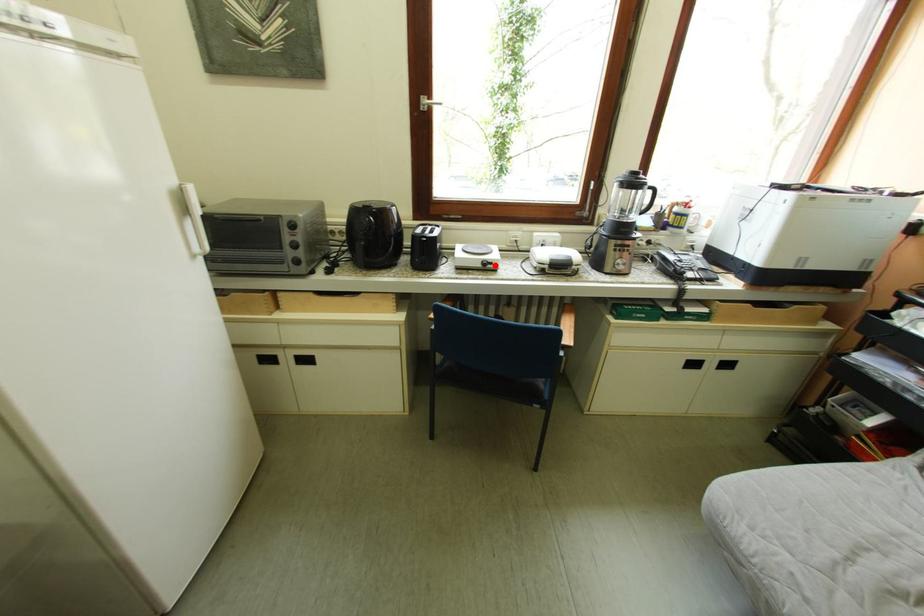
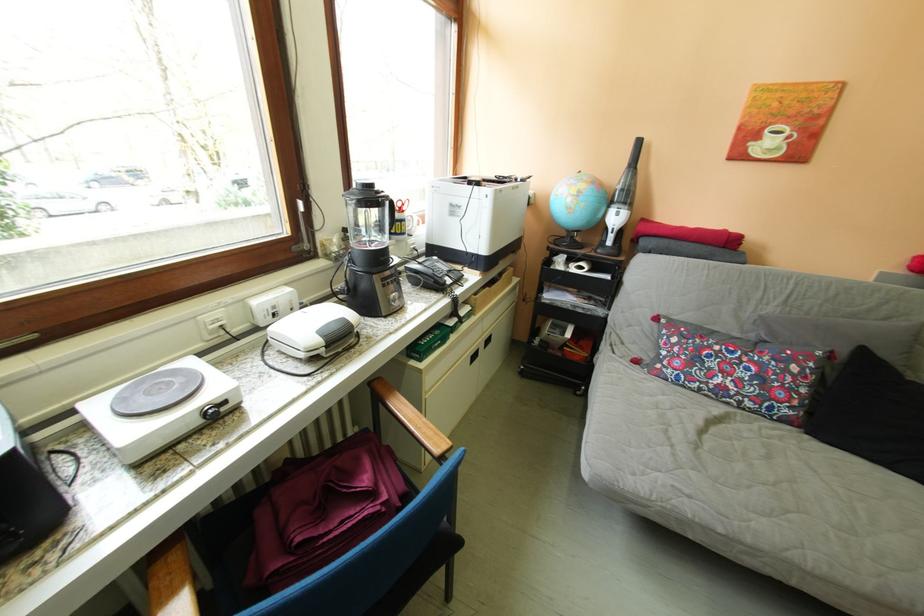
In the second image, find the point that corresponds to the highlighted location in the first image.

(216, 416)